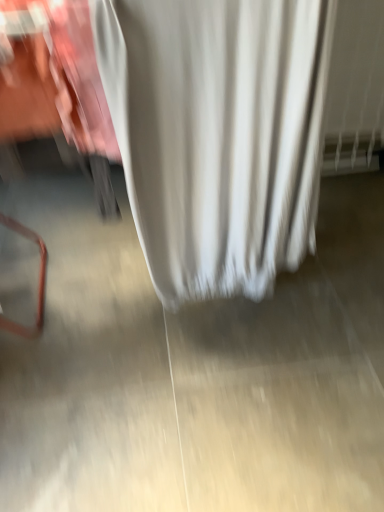
Question: Considering the relative sizes of white fabric curtain at center and smooth concrete floor at center in the image provided, is white fabric curtain at center thinner than smooth concrete floor at center?

Choices:
 (A) no
 (B) yes

Answer: (B)

Question: Would you say white fabric curtain at center is a long distance from smooth concrete floor at center?

Choices:
 (A) yes
 (B) no

Answer: (B)

Question: Does white fabric curtain at center come in front of smooth concrete floor at center?

Choices:
 (A) yes
 (B) no

Answer: (A)

Question: Considering the relative sizes of white fabric curtain at center and smooth concrete floor at center in the image provided, is white fabric curtain at center shorter than smooth concrete floor at center?

Choices:
 (A) yes
 (B) no

Answer: (B)

Question: Is white fabric curtain at center bigger than smooth concrete floor at center?

Choices:
 (A) yes
 (B) no

Answer: (A)

Question: Is white fabric curtain at center facing towards smooth concrete floor at center?

Choices:
 (A) no
 (B) yes

Answer: (A)

Question: Would you say smooth concrete floor at center contains white fabric curtain at center?

Choices:
 (A) no
 (B) yes

Answer: (A)

Question: From the image's perspective, is smooth concrete floor at center on white fabric curtain at center?

Choices:
 (A) yes
 (B) no

Answer: (B)

Question: Is smooth concrete floor at center far from white fabric curtain at center?

Choices:
 (A) no
 (B) yes

Answer: (A)

Question: Does smooth concrete floor at center have a greater height compared to white fabric curtain at center?

Choices:
 (A) no
 (B) yes

Answer: (A)

Question: Is smooth concrete floor at center smaller than white fabric curtain at center?

Choices:
 (A) yes
 (B) no

Answer: (A)

Question: From a real-world perspective, is smooth concrete floor at center located higher than white fabric curtain at center?

Choices:
 (A) no
 (B) yes

Answer: (A)

Question: Looking at their shapes, would you say white fabric curtain at center is wider or thinner than smooth concrete floor at center?

Choices:
 (A) wide
 (B) thin

Answer: (B)